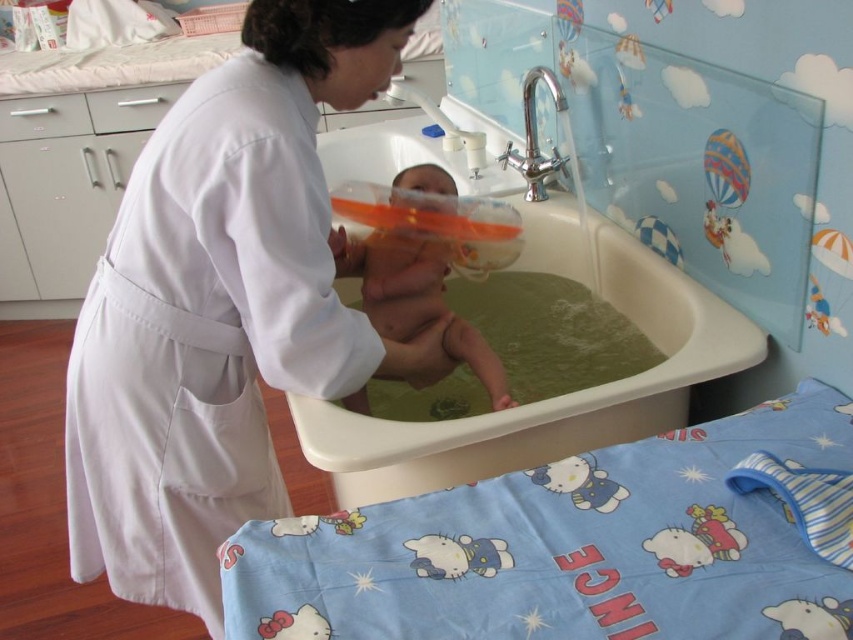
Does point (146, 177) come closer to viewer compared to point (434, 186)?

Yes, it is.

Is point (340, 97) positioned in front of point (474, 340)?

Yes, point (340, 97) is in front of point (474, 340).

Find the location of a particular element. This screenshot has width=853, height=640. white matte uniform at center is located at coordinates (224, 305).

Is green plastic bath at center taller than smooth orange rubber tub at center?

Yes, green plastic bath at center is taller than smooth orange rubber tub at center.

The image size is (853, 640). I want to click on green plastic bath at center, so click(552, 397).

Identify the location of green plastic bath at center. (552, 397).

Does white matte uniform at center have a greater height compared to green plastic bath at center?

Correct, white matte uniform at center is much taller as green plastic bath at center.

Is white matte uniform at center to the right of green plastic bath at center from the viewer's perspective?

No, white matte uniform at center is not to the right of green plastic bath at center.

Is point (230, 305) more distant than point (402, 445)?

Yes, point (230, 305) is farther from viewer.

The width and height of the screenshot is (853, 640). I want to click on white matte uniform at center, so 224,305.